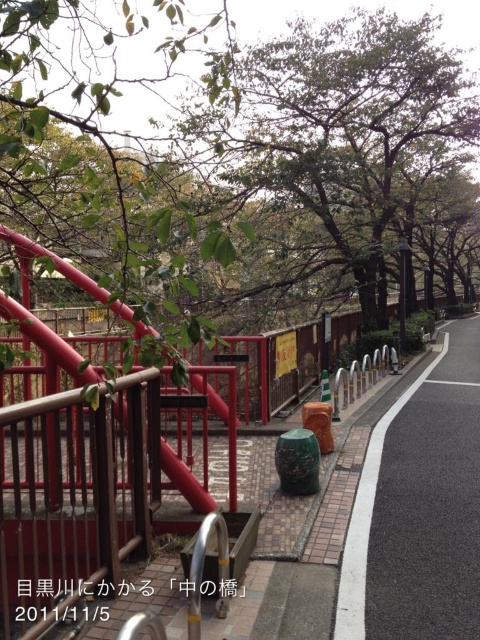
You are standing at the center of the image and want to walk to the asphalt at lower right. According to the coordinates provided, in which direction should you move relative to your current position?

You should move towards the lower right direction to reach the asphalt at lower right as it is located at point (420, 508).

You are a gardener who needs to trim the green leafy tree at center and the red matte railing at center. Which object requires more attention because it is larger?

The green leafy tree at center requires more attention because it is bigger than the red matte railing at center.

You are a landscape architect designing a new park. You need to decide where to plant a new tree. Considering the scene, would the green leafy tree at center be taller than the asphalt at lower right if planted in the same area?

The green leafy tree at center is much taller than the asphalt at lower right, so yes, it would be taller if planted in the same area.